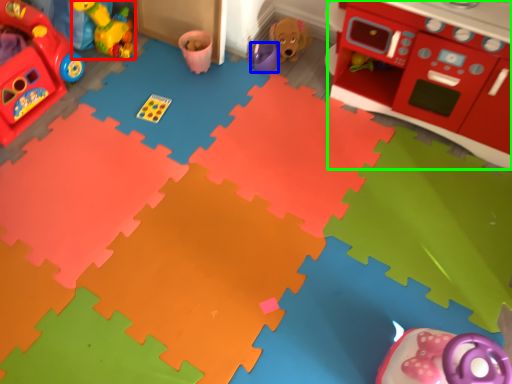
Question: Which object is the farthest from toy (highlighted by a red box)? Choose among these: toy (highlighted by a blue box) or appliance (highlighted by a green box).

Choices:
 (A) toy
 (B) appliance

Answer: (B)